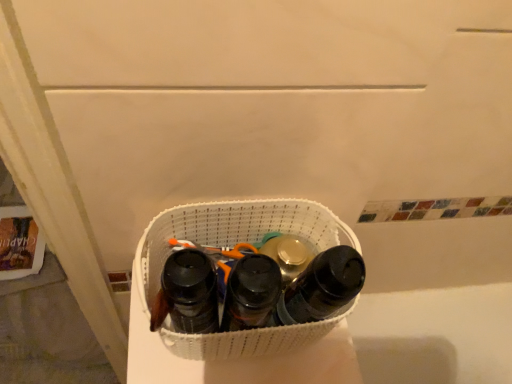
Question: Are white woven laundry basket at center and black matte bottle at center, which is the 3th footwear from left to right, located far from each other?

Choices:
 (A) yes
 (B) no

Answer: (B)

Question: From the image's perspective, is white woven laundry basket at center beneath black matte bottle at center, which is the 3th footwear from left to right?

Choices:
 (A) no
 (B) yes

Answer: (A)

Question: Is white woven laundry basket at center at the right side of black matte bottle at center, the first footwear in the right-to-left sequence?

Choices:
 (A) yes
 (B) no

Answer: (B)

Question: From the image's perspective, is white woven laundry basket at center above black matte bottle at center, which is the 3th footwear from left to right?

Choices:
 (A) no
 (B) yes

Answer: (B)

Question: From a real-world perspective, is white woven laundry basket at center positioned under black matte bottle at center, which is the 3th footwear from left to right, based on gravity?

Choices:
 (A) yes
 (B) no

Answer: (A)

Question: Does white woven laundry basket at center appear on the left side of black matte bottle at center, which is the 3th footwear from left to right?

Choices:
 (A) yes
 (B) no

Answer: (A)

Question: Is white woven laundry basket at center located outside black matte shoe at center, which is the second footwear in left-to-right order?

Choices:
 (A) yes
 (B) no

Answer: (A)

Question: Would you say white woven laundry basket at center contains black matte shoe at center, the 2th footwear viewed from the right?

Choices:
 (A) no
 (B) yes

Answer: (B)

Question: Does white woven laundry basket at center appear on the right side of black matte shoe at center, the 2th footwear viewed from the right?

Choices:
 (A) no
 (B) yes

Answer: (A)

Question: Can you confirm if white woven laundry basket at center is thinner than black matte shoe at center, the 2th footwear viewed from the right?

Choices:
 (A) no
 (B) yes

Answer: (A)

Question: From a real-world perspective, is white woven laundry basket at center beneath black matte shoe at center, the 2th footwear viewed from the right?

Choices:
 (A) no
 (B) yes

Answer: (B)

Question: Can you confirm if white woven laundry basket at center is smaller than black matte shoe at center, which is the second footwear in left-to-right order?

Choices:
 (A) no
 (B) yes

Answer: (A)

Question: Could black matte water bottle at center, the 3th footwear positioned from the right, be considered to be inside black matte bottle at center, which is the 3th footwear from left to right?

Choices:
 (A) yes
 (B) no

Answer: (B)